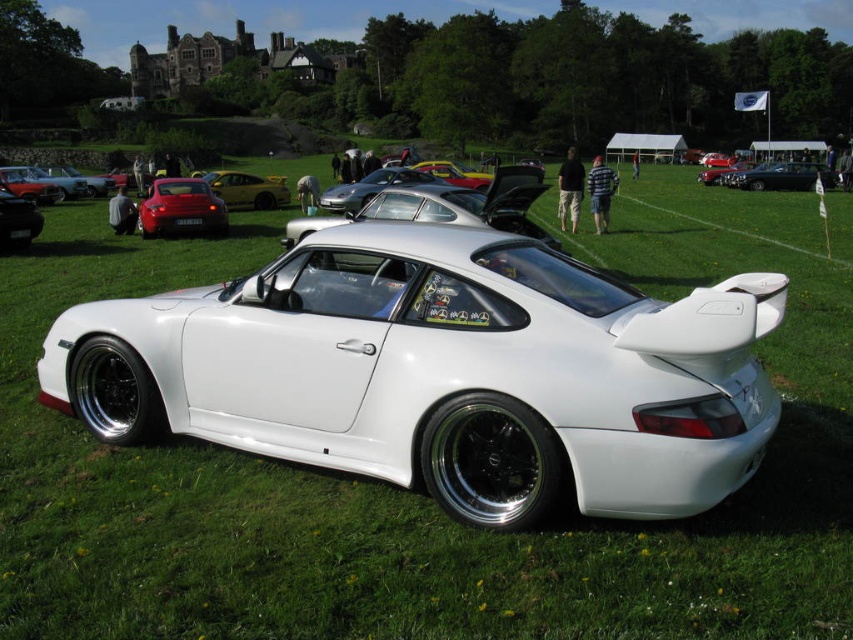
Question: Is shiny black sedan at center bigger than satin silver convertible at center?

Choices:
 (A) no
 (B) yes

Answer: (B)

Question: Considering the relative positions of yellow matte sports car at center and shiny black sedan at center in the image provided, where is yellow matte sports car at center located with respect to shiny black sedan at center?

Choices:
 (A) below
 (B) above

Answer: (A)

Question: Observing the image, what is the correct spatial positioning of yellow matte sports car at center in reference to shiny black car at left?

Choices:
 (A) above
 (B) below

Answer: (A)

Question: Which point appears farthest from the camera in this image?

Choices:
 (A) (16, 234)
 (B) (247, 177)
 (C) (833, 180)

Answer: (C)

Question: Which is farther from the shiny black car at left?

Choices:
 (A) shiny black sedan at center
 (B) white glossy sports car at center
 (C) satin silver convertible at center

Answer: (A)

Question: Which of the following is the farthest from the observer?

Choices:
 (A) (10, 244)
 (B) (200, 179)
 (C) (780, 180)
 (D) (367, 192)

Answer: (C)